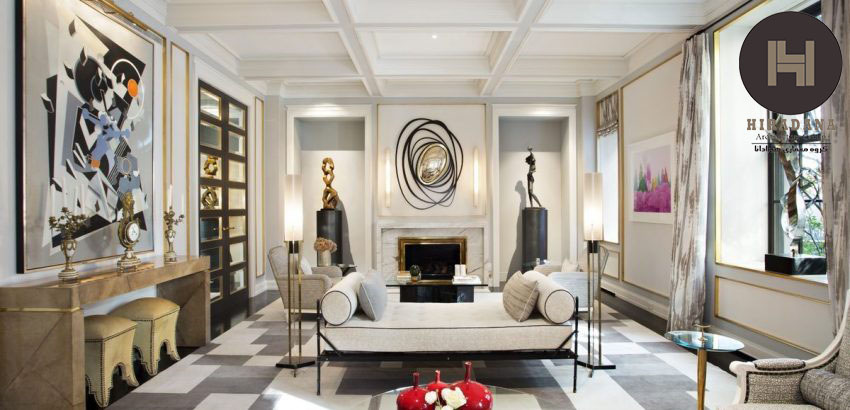
You are a GUI agent. You are given a task and a screenshot of the screen. Output one action in this format:
    pyautogui.click(x=<x>, y=<y>)
    Task: Click on the couch
    
    Given the screenshot: What is the action you would take?
    pyautogui.click(x=476, y=324)